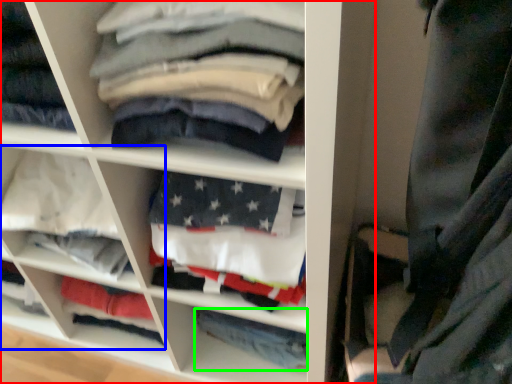
Question: Which is nearer to the shelf (highlighted by a red box)? cabinet (highlighted by a blue box) or trousers (highlighted by a green box).

Choices:
 (A) cabinet
 (B) trousers

Answer: (A)